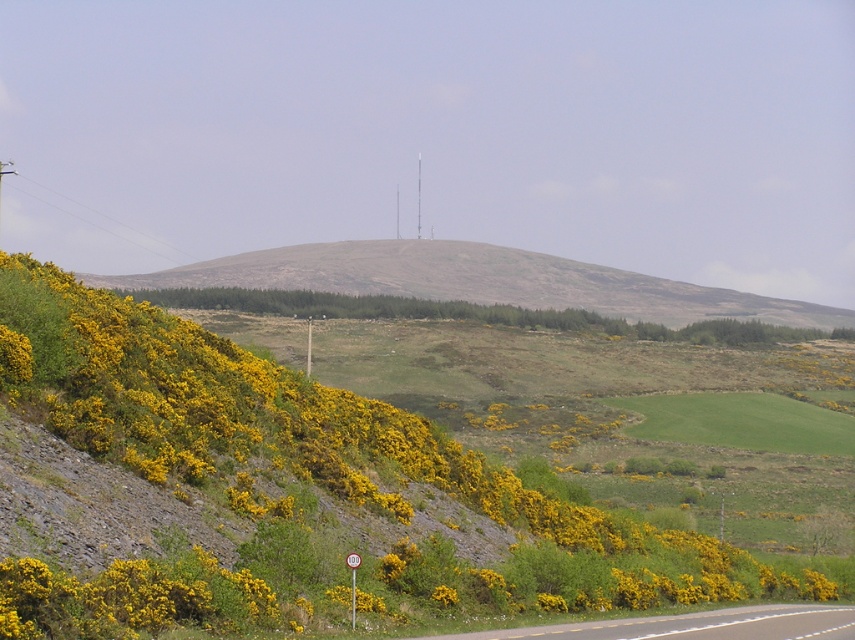
Question: Which object appears closest to the camera in this image?

Choices:
 (A) asphalt road at lower right
 (B) grassy hillside at center

Answer: (A)

Question: In this image, where is yellow rough textured bush at left located relative to grassy hillside at center?

Choices:
 (A) above
 (B) below

Answer: (B)

Question: From the image, what is the correct spatial relationship of grassy hillside at center in relation to asphalt road at lower right?

Choices:
 (A) above
 (B) below

Answer: (A)

Question: Is grassy hillside at center in front of asphalt road at lower right?

Choices:
 (A) no
 (B) yes

Answer: (A)

Question: Based on their relative distances, which object is nearer to the grassy hillside at center?

Choices:
 (A) asphalt road at lower right
 (B) yellow rough textured bush at left

Answer: (B)

Question: Considering the real-world distances, which object is farthest from the yellow rough textured bush at left?

Choices:
 (A) grassy hillside at center
 (B) asphalt road at lower right

Answer: (A)